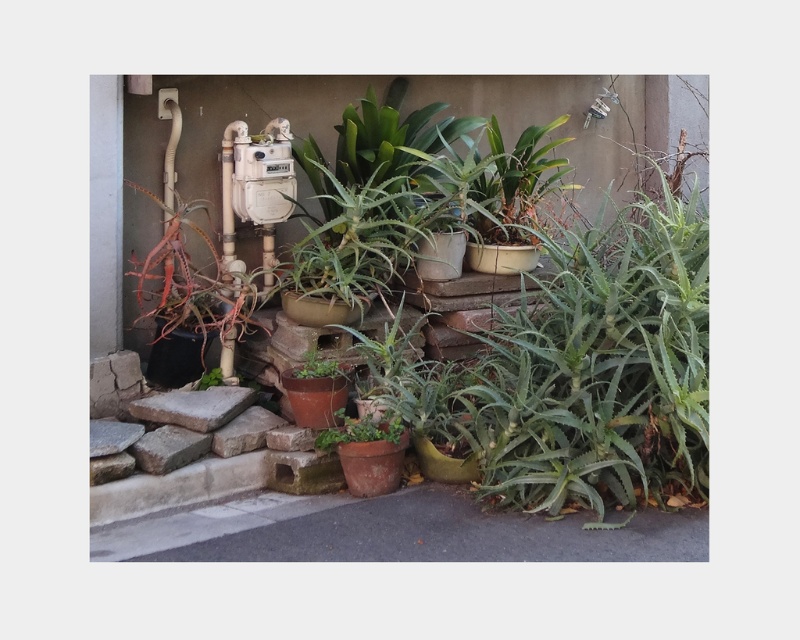
From the picture: Can you confirm if green matte pot at center is thinner than green matte plant at center?

No, green matte pot at center is not thinner than green matte plant at center.

Does green matte pot at center have a lesser height compared to green matte plant at center?

No, green matte pot at center is not shorter than green matte plant at center.

Locate an element on the screen. The width and height of the screenshot is (800, 640). green matte pot at center is located at coordinates (360, 429).

The image size is (800, 640). Find the location of `green matte pot at center`. green matte pot at center is located at coordinates (360, 429).